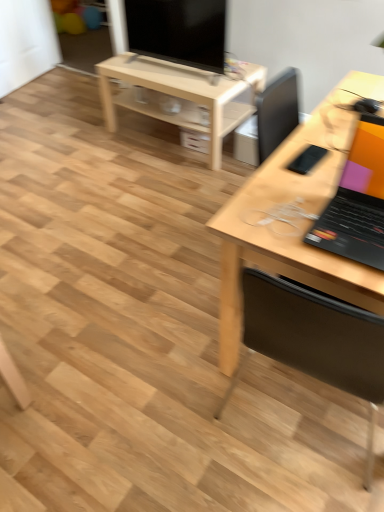
The height and width of the screenshot is (512, 384). Find the location of `free spot behind black matte laptop at right`. free spot behind black matte laptop at right is located at coordinates (308, 173).